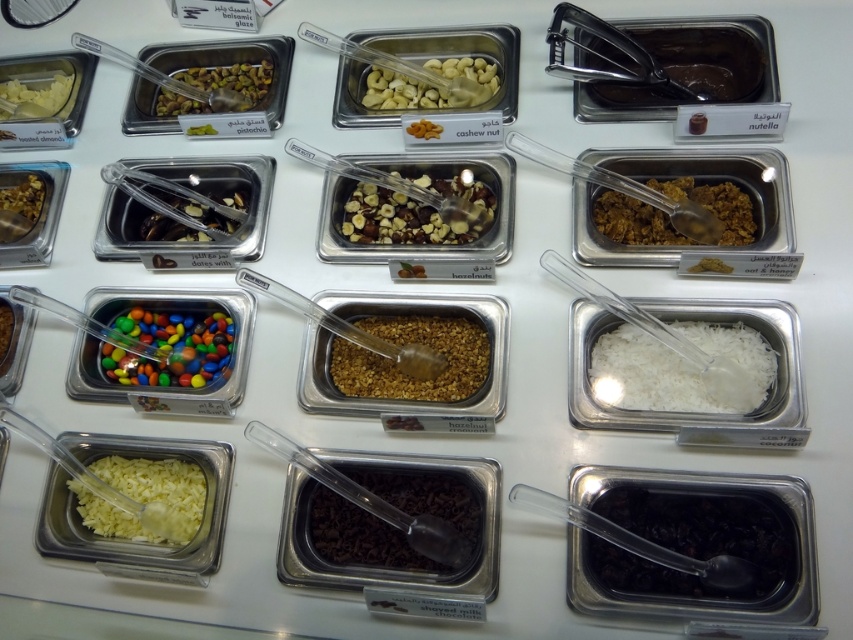
Is dark chocolate chips at center to the left of brown crumbly topping at upper left from the viewer's perspective?

In fact, dark chocolate chips at center is to the right of brown crumbly topping at upper left.

From the picture: Who is taller, dark chocolate chips at center or brown crumbly topping at upper left?

Standing taller between the two is brown crumbly topping at upper left.

The height and width of the screenshot is (640, 853). Describe the element at coordinates (364, 538) in the screenshot. I see `dark chocolate chips at center` at that location.

This screenshot has height=640, width=853. I want to click on dark chocolate chips at center, so click(364, 538).

Between white glossy cashew nuts at center and matte brown nuts at upper left, which one appears on the right side from the viewer's perspective?

white glossy cashew nuts at center

Can you confirm if white glossy cashew nuts at center is positioned above matte brown nuts at upper left?

Incorrect, white glossy cashew nuts at center is not positioned above matte brown nuts at upper left.

Which is behind, point (437, 60) or point (252, 68)?

The point (252, 68) is behind.

Where is `white glossy cashew nuts at center`? white glossy cashew nuts at center is located at coordinates (432, 84).

Can you confirm if white crumbly topping at bottom left is shorter than white creamy cheese at upper left?

Indeed, white crumbly topping at bottom left has a lesser height compared to white creamy cheese at upper left.

Does white crumbly topping at bottom left have a greater height compared to white creamy cheese at upper left?

In fact, white crumbly topping at bottom left may be shorter than white creamy cheese at upper left.

Is point (177, 506) farther from viewer compared to point (10, 106)?

No, it is in front of (10, 106).

Where is `white crumbly topping at bottom left`? This screenshot has height=640, width=853. white crumbly topping at bottom left is located at coordinates (155, 483).